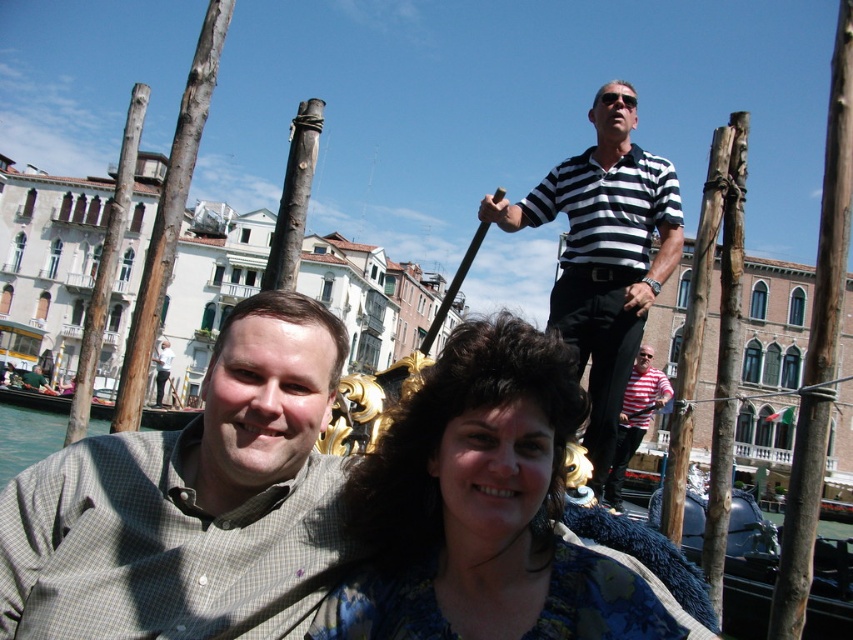
This screenshot has height=640, width=853. What do you see at coordinates (480, 509) in the screenshot? I see `blue floral blouse at center` at bounding box center [480, 509].

Does point (451, 621) lie in front of point (647, 396)?

Yes, it is.

Who is more distant from viewer, (418, 458) or (660, 404)?

The point (660, 404) is more distant.

Locate an element on the screen. blue floral blouse at center is located at coordinates (480, 509).

Is gray checkered shirt at center positioned behind black striped shirt at upper center?

That is False.

Is point (248, 440) closer to camera compared to point (578, 374)?

That is True.

Which is behind, point (166, 483) or point (606, 336)?

Positioned behind is point (606, 336).

Locate an element on the screen. The image size is (853, 640). gray checkered shirt at center is located at coordinates (190, 502).

Is gray checkered shirt at center smaller than striped cotton shirt at upper center?

Indeed, gray checkered shirt at center has a smaller size compared to striped cotton shirt at upper center.

Which is behind, point (320, 573) or point (635, 404)?

The point (635, 404) is behind.

Is point (38, 572) behind point (654, 385)?

No, (38, 572) is closer to viewer.

At what (x,y) coordinates should I click in order to perform the action: click on gray checkered shirt at center. Please return your answer as a coordinate pair (x, y). The width and height of the screenshot is (853, 640). Looking at the image, I should click on (190, 502).